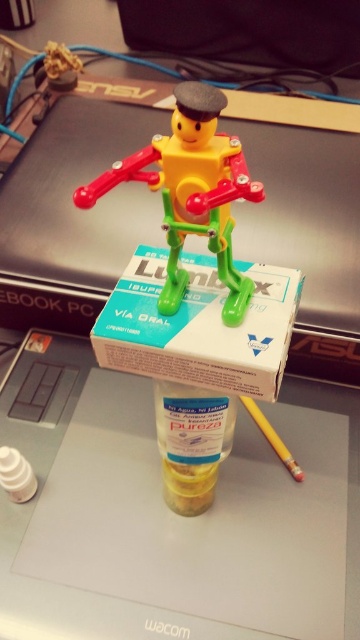
Question: Which object appears closest to the camera in this image?

Choices:
 (A) translucent plastic bottle at center
 (B) green cardboard box at center
 (C) yellow plastic toy at center
 (D) yellow matte pencil at lower right

Answer: (C)

Question: Considering the relative positions of green cardboard box at center and yellow matte pencil at lower right in the image provided, where is green cardboard box at center located with respect to yellow matte pencil at lower right?

Choices:
 (A) right
 (B) left

Answer: (B)

Question: Is translucent plastic bottle at center bigger than yellow matte pencil at lower right?

Choices:
 (A) no
 (B) yes

Answer: (B)

Question: Which of the following is the farthest from the observer?

Choices:
 (A) green cardboard box at center
 (B) yellow matte pencil at lower right
 (C) translucent plastic bottle at center

Answer: (B)

Question: Which is farther from the translucent plastic bottle at center?

Choices:
 (A) yellow plastic toy at center
 (B) yellow matte pencil at lower right

Answer: (A)

Question: Does yellow plastic toy at center appear on the right side of translucent plastic bottle at center?

Choices:
 (A) no
 (B) yes

Answer: (A)